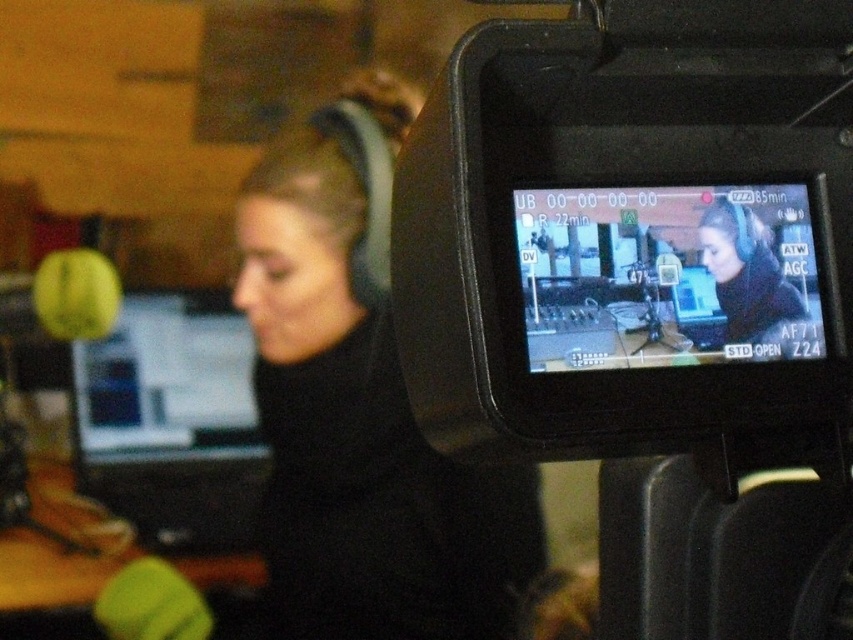
Question: Among these points, which one is nearest to the camera?

Choices:
 (A) (744, 240)
 (B) (767, 163)

Answer: (A)

Question: Is black glossy monitor at center wider than matte black headphones at upper center?

Choices:
 (A) no
 (B) yes

Answer: (B)

Question: Is black plastic camera at center thinner than matte black monitor at left?

Choices:
 (A) yes
 (B) no

Answer: (B)

Question: Which object is the closest to the black glossy monitor at center?

Choices:
 (A) matte black monitor at left
 (B) matte black headphones at upper center
 (C) black plastic camera at center

Answer: (C)

Question: Can you confirm if black plastic camera at center is positioned below matte black headphones at upper center?

Choices:
 (A) yes
 (B) no

Answer: (B)

Question: Which point is closer to the camera taking this photo?

Choices:
 (A) (257, 440)
 (B) (695, 360)
 (C) (786, 356)
 (D) (776, 260)

Answer: (B)